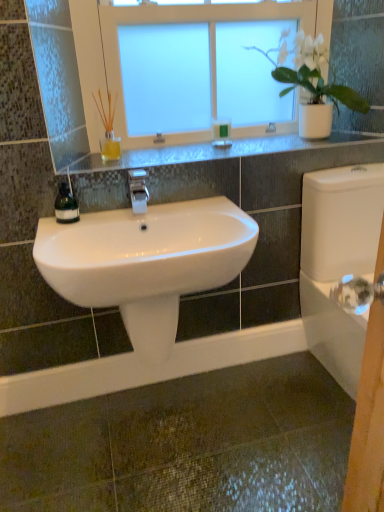
The image size is (384, 512). I want to click on vacant area situated to the left side of white glossy faucet at center, so click(107, 215).